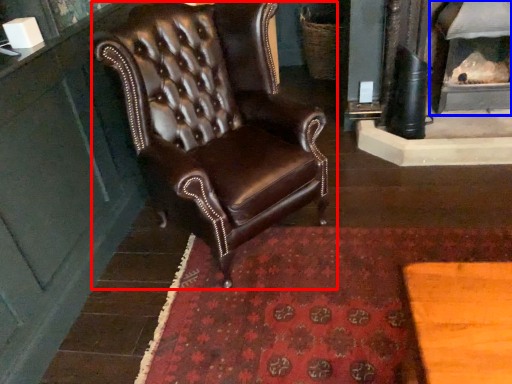
Question: Which point is closer to the camera, chair (highlighted by a red box) or fireplace (highlighted by a blue box)?

Choices:
 (A) chair
 (B) fireplace

Answer: (A)